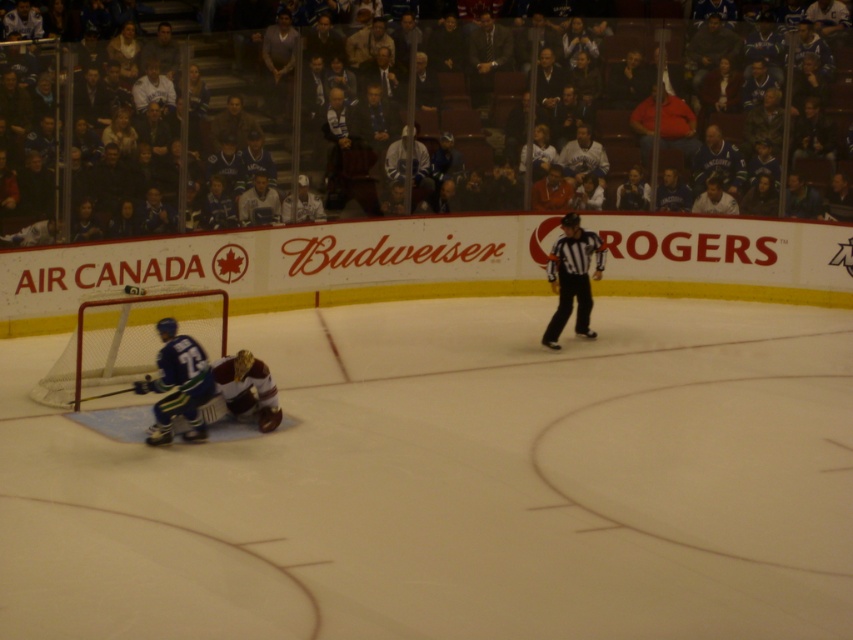
Question: Is black mesh referee at center bigger than maroon jersey at center?

Choices:
 (A) yes
 (B) no

Answer: (A)

Question: Based on their relative distances, which object is nearer to the black mesh referee at center?

Choices:
 (A) blue jersey at lower left
 (B) maroon jersey at center

Answer: (B)

Question: Which of these objects is positioned farthest from the black mesh referee at center?

Choices:
 (A) blue jersey at lower left
 (B) maroon jersey at center

Answer: (A)

Question: Among these objects, which one is farthest from the camera?

Choices:
 (A) black mesh referee at center
 (B) blue jersey at lower left
 (C) maroon jersey at center

Answer: (A)

Question: Observing the image, what is the correct spatial positioning of blue jersey at lower left in reference to black mesh referee at center?

Choices:
 (A) above
 (B) below

Answer: (B)

Question: Does black mesh referee at center appear under maroon jersey at center?

Choices:
 (A) yes
 (B) no

Answer: (B)